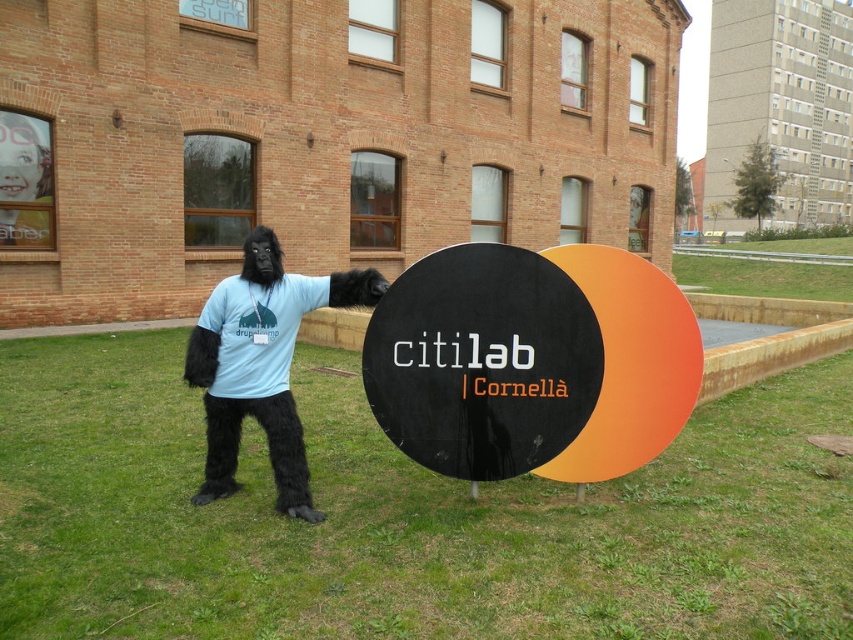
You are a photographer trying to capture a clear shot of both the green grass at center and the fuzzy black gorilla at center. Since the camera can only focus on one object at a time, which object should you choose to ensure the other is still somewhat in focus?

The green grass at center is bigger than the fuzzy black gorilla at center, so focusing on the green grass at center will keep the fuzzy black gorilla at center in better focus due to its smaller size.

You are a photographer trying to capture a photo of the green grass at center and the black matte sign at center. Based on their positions, which object should you focus on first if you want both to be in sharp focus?

The green grass at center is below the black matte sign at center, so you should focus on the black matte sign at center first because it is closer to the camera, ensuring both will be in focus when using a shallow depth of field.

You are a photographer trying to capture a clear photo of the fuzzy black gorilla at center. However, the green grass at center is blocking your view. Can you determine if the grass is in front of or behind the gorilla?

The green grass at center is in front of the fuzzy black gorilla at center, so it is blocking the view.